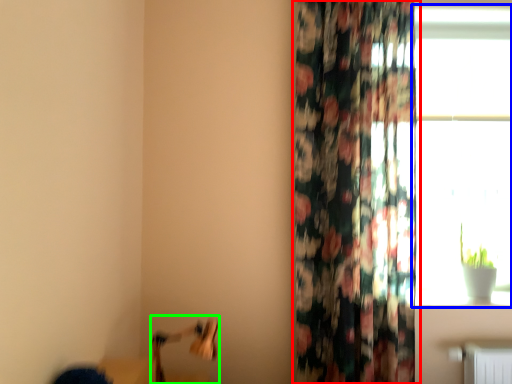
Question: Considering the real-world distances, which object is closest to curtain (highlighted by a red box)? window (highlighted by a blue box) or swivel chair (highlighted by a green box).

Choices:
 (A) window
 (B) swivel chair

Answer: (A)